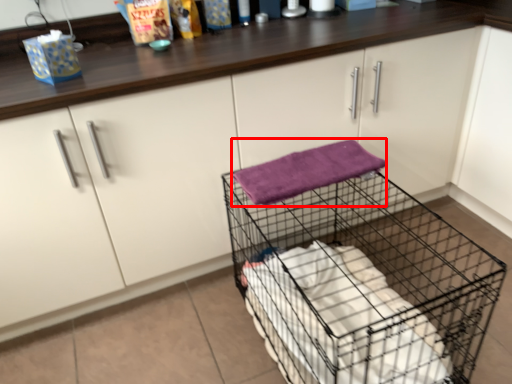
Question: From the image, what is the correct spatial relationship of bath towel (annotated by the red box) in relation to trolley?

Choices:
 (A) right
 (B) left

Answer: (B)